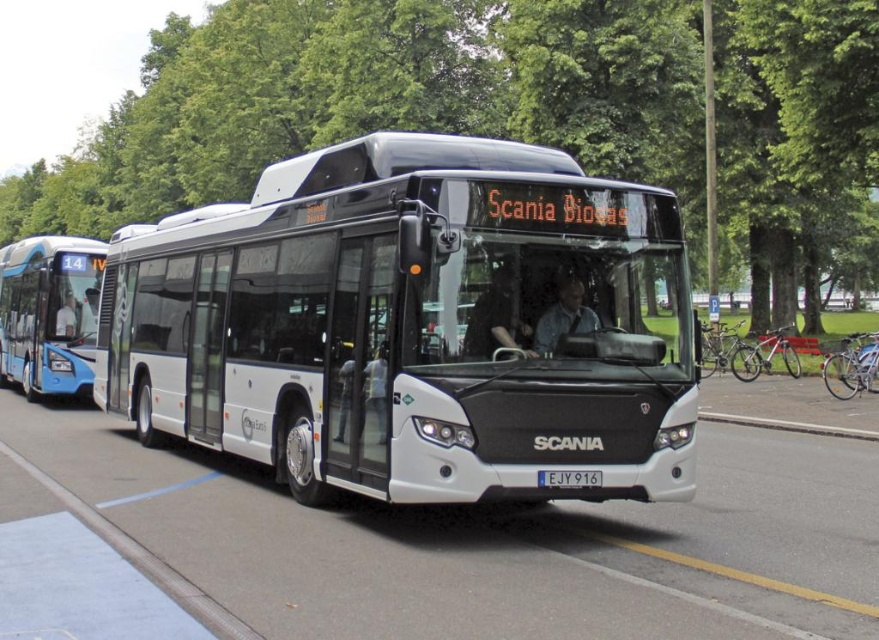
Question: Which of the following is the farthest from the observer?

Choices:
 (A) (587, 474)
 (B) (134, 496)
 (C) (558, 323)

Answer: (B)

Question: Which of the following is the farthest from the observer?

Choices:
 (A) (2, 323)
 (B) (294, 90)

Answer: (B)

Question: Which object appears farthest from the camera in this image?

Choices:
 (A) white matte bus at center
 (B) white plastic license plate at center

Answer: (B)

Question: Does green leafy tree at upper center lie behind white rubber line at lower center?

Choices:
 (A) no
 (B) yes

Answer: (B)

Question: Can you confirm if green leafy tree at upper center is positioned above blue glossy bus at left?

Choices:
 (A) yes
 (B) no

Answer: (A)

Question: Is blue fabric shirt at center bigger than white rubber line at lower center?

Choices:
 (A) no
 (B) yes

Answer: (A)